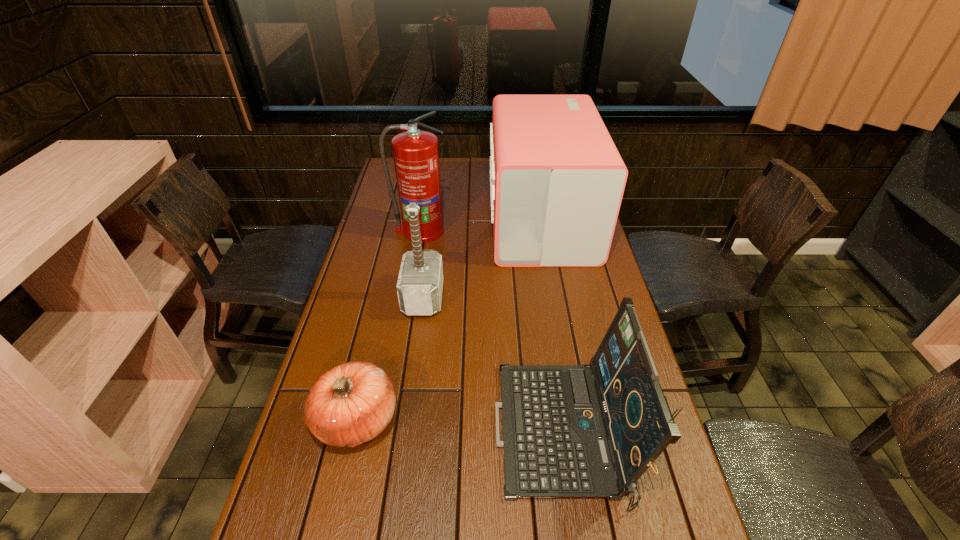
Locate an element on the screen. The height and width of the screenshot is (540, 960). free space at the far edge is located at coordinates point(468,184).

The image size is (960, 540). I want to click on vacant space at the left edge of the desktop, so click(x=298, y=496).

Where is `free space at the right edge of the desktop`? This screenshot has height=540, width=960. free space at the right edge of the desktop is located at coordinates (683, 512).

Find the location of a particular element. free space between the box and the tallest object is located at coordinates (481, 225).

Find the location of a particular element. This screenshot has width=960, height=540. free space between the box and the tallest object is located at coordinates (481, 225).

Identify the location of empty space that is in between the second shortest object and the shortest object. (460, 426).

Locate an element on the screen. The height and width of the screenshot is (540, 960). unoccupied area between the pumpkin and the fire extinguisher is located at coordinates (389, 325).

Locate an element on the screen. empty space between the fire extinguisher and the box is located at coordinates (481, 225).

What are the coordinates of `empty location between the pumpkin and the box` in the screenshot? It's located at (449, 319).

Identify the location of vacant region between the fire extinguisher and the box. (481, 225).